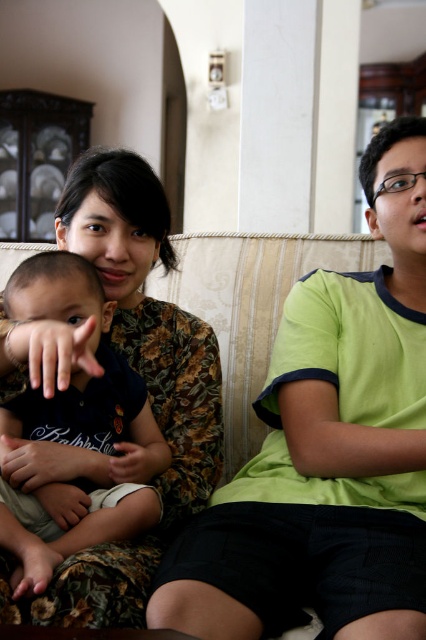
Question: Is dark blue fabric baby at left positioned behind beige fabric couch at center?

Choices:
 (A) no
 (B) yes

Answer: (A)

Question: Is dark blue fabric baby at left wider than beige fabric couch at center?

Choices:
 (A) yes
 (B) no

Answer: (B)

Question: Which point is farther from the camera taking this photo?

Choices:
 (A) (325, 388)
 (B) (140, 426)

Answer: (B)

Question: Which point is farther to the camera?

Choices:
 (A) beige fabric couch at center
 (B) dark blue fabric baby at left

Answer: (A)

Question: Does dark blue fabric baby at left appear on the right side of beige fabric couch at center?

Choices:
 (A) no
 (B) yes

Answer: (A)